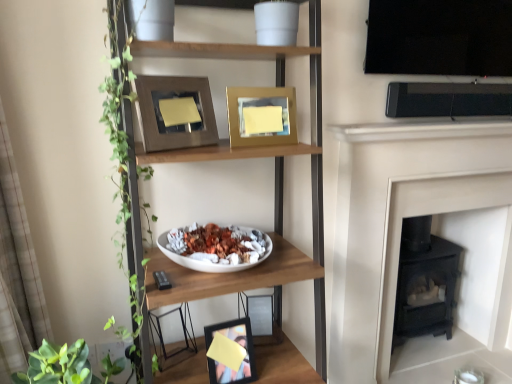
Question: Considering the positions of metallic silver photo frame at lower center, which is the 3th picture frame from top to bottom, and matte black picture frame at lower center, which is the 1th picture frame from bottom to top, in the image, is metallic silver photo frame at lower center, which is the 3th picture frame from top to bottom, wider or thinner than matte black picture frame at lower center, which is the 1th picture frame from bottom to top,?

Choices:
 (A) thin
 (B) wide

Answer: (A)

Question: Is point (257, 332) positioned closer to the camera than point (215, 362)?

Choices:
 (A) closer
 (B) farther

Answer: (B)

Question: Which object is positioned closest to the wooden shelf at center?

Choices:
 (A) metallic silver photo frame at lower center, the 2th picture frame positioned from the bottom
 (B) black matte fireplace at right
 (C) matte black picture frame at lower center, which is the fourth picture frame in top-to-bottom order
 (D) beige fabric curtain at left
 (E) gold metallic picture frame at upper center, which is the 2th picture frame from top to bottom

Answer: (E)

Question: Which object is positioned farthest from the beige fabric curtain at left?

Choices:
 (A) wooden frame at upper center, the 1th picture frame positioned from the top
 (B) gold metallic picture frame at upper center, acting as the third picture frame starting from the bottom
 (C) wooden shelf at center
 (D) metallic silver photo frame at lower center, the 2th picture frame positioned from the bottom
 (E) matte black picture frame at lower center, which is the 1th picture frame from bottom to top

Answer: (D)